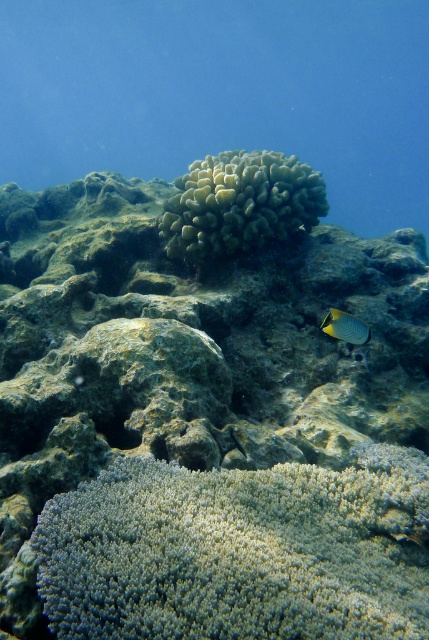
Question: Which object is positioned closest to the white coral at center?

Choices:
 (A) shiny silver fish at center right
 (B) green textured coral at center
 (C) soft yellow coral at center

Answer: (B)

Question: Is green textured coral at center below soft yellow coral at center?

Choices:
 (A) yes
 (B) no

Answer: (A)

Question: Observing the image, what is the correct spatial positioning of green textured coral at center in reference to white coral at center?

Choices:
 (A) below
 (B) above

Answer: (B)

Question: Which object is farther from the camera taking this photo?

Choices:
 (A) shiny silver fish at center right
 (B) green textured coral at center

Answer: (A)

Question: Which point appears closest to the camera in this image?

Choices:
 (A) (256, 225)
 (B) (21, 212)

Answer: (A)

Question: Is soft yellow coral at center thinner than shiny silver fish at center right?

Choices:
 (A) no
 (B) yes

Answer: (A)